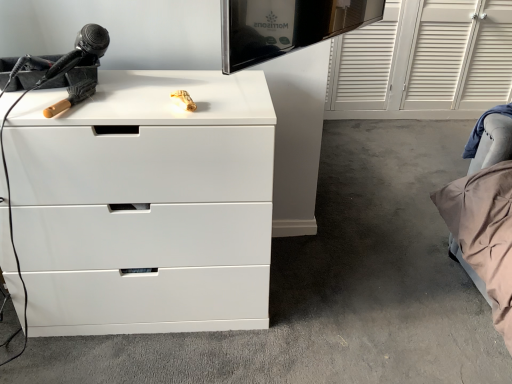
What is the approximate height of white glossy chest of drawers at upper left?

The height of white glossy chest of drawers at upper left is 29.83 inches.

The height and width of the screenshot is (384, 512). What do you see at coordinates (145, 204) in the screenshot? I see `white glossy chest of drawers at upper left` at bounding box center [145, 204].

At what (x,y) coordinates should I click in order to perform the action: click on white glossy chest of drawers at upper left. Please return your answer as a coordinate pair (x, y). This screenshot has width=512, height=384. Looking at the image, I should click on (145, 204).

Image resolution: width=512 pixels, height=384 pixels. Identify the location of white glossy dresser at center. (332, 287).

What do you see at coordinates (332, 287) in the screenshot?
I see `white glossy dresser at center` at bounding box center [332, 287].

This screenshot has width=512, height=384. In order to click on white glossy chest of drawers at upper left in this screenshot , I will do `click(145, 204)`.

In the image, is white glossy dresser at center on the left side or the right side of white glossy chest of drawers at upper left?

In the image, white glossy dresser at center appears on the right side of white glossy chest of drawers at upper left.

Which object is further away from the camera, white glossy dresser at center or white glossy chest of drawers at upper left?

white glossy dresser at center is more distant.

Considering the points (302, 372) and (126, 241), which point is behind, point (302, 372) or point (126, 241)?

The point (302, 372) is farther from the camera.

From the image's perspective, relative to white glossy chest of drawers at upper left, is white glossy dresser at center above or below?

Clearly, from the image's perspective, white glossy dresser at center is above white glossy chest of drawers at upper left.

From a real-world perspective, who is located higher, white glossy dresser at center or white glossy chest of drawers at upper left?

white glossy chest of drawers at upper left.

Looking at this image, in terms of width, does white glossy dresser at center look wider or thinner when compared to white glossy chest of drawers at upper left?

Clearly, white glossy dresser at center has more width compared to white glossy chest of drawers at upper left.

Who is shorter, white glossy dresser at center or white glossy chest of drawers at upper left?

white glossy dresser at center is shorter.

Considering the sizes of white glossy dresser at center and white glossy chest of drawers at upper left in the image, is white glossy dresser at center bigger or smaller than white glossy chest of drawers at upper left?

Clearly, white glossy dresser at center is larger in size than white glossy chest of drawers at upper left.

Is white glossy chest of drawers at upper left surrounded by white glossy dresser at center?

No, white glossy chest of drawers at upper left is not inside white glossy dresser at center.

Based on the photo, is white glossy dresser at center placed right next to white glossy chest of drawers at upper left?

No.

Is white glossy chest of drawers at upper left at the back of white glossy dresser at center?

No, white glossy dresser at center's orientation is not away from white glossy chest of drawers at upper left.

How different are the orientations of white glossy dresser at center and white glossy chest of drawers at upper left in degrees?

The facing directions of white glossy dresser at center and white glossy chest of drawers at upper left are 90.8 degrees apart.

How far apart are white glossy dresser at center and white glossy chest of drawers at upper left?

white glossy dresser at center and white glossy chest of drawers at upper left are 18.66 inches apart.

Image resolution: width=512 pixels, height=384 pixels. I want to click on concrete that is under the white glossy chest of drawers at upper left (from a real-world perspective), so click(x=332, y=287).

Which object is positioned more to the right, white glossy chest of drawers at upper left or white glossy dresser at center?

Positioned to the right is white glossy dresser at center.

Is white glossy chest of drawers at upper left positioned behind white glossy dresser at center?

No, the depth of white glossy chest of drawers at upper left is less than that of white glossy dresser at center.

Which is in front, point (37, 249) or point (155, 368)?

The point (37, 249) is closer.

From the image's perspective, which object appears higher, white glossy chest of drawers at upper left or white glossy dresser at center?

white glossy dresser at center is shown above in the image.

From a real-world perspective, is white glossy chest of drawers at upper left physically located above or below white glossy dresser at center?

white glossy chest of drawers at upper left is situated higher than white glossy dresser at center in the real world.

Is white glossy chest of drawers at upper left wider or thinner than white glossy dresser at center?

white glossy chest of drawers at upper left is thinner than white glossy dresser at center.

Considering the relative sizes of white glossy chest of drawers at upper left and white glossy dresser at center in the image provided, is white glossy chest of drawers at upper left taller than white glossy dresser at center?

Indeed, white glossy chest of drawers at upper left has a greater height compared to white glossy dresser at center.

Is white glossy chest of drawers at upper left smaller than white glossy dresser at center?

Yes.

Is white glossy chest of drawers at upper left not within white glossy dresser at center?

Indeed, white glossy chest of drawers at upper left is completely outside white glossy dresser at center.

Is the surface of white glossy chest of drawers at upper left in direct contact with white glossy dresser at center?

No, white glossy chest of drawers at upper left is not with white glossy dresser at center.

Is white glossy chest of drawers at upper left facing away from white glossy dresser at center?

That's not correct — white glossy chest of drawers at upper left is not looking away from white glossy dresser at center.

How much distance is there between white glossy chest of drawers at upper left and white glossy dresser at center?

The distance of white glossy chest of drawers at upper left from white glossy dresser at center is 18.66 inches.

In order to click on concrete on the right of white glossy chest of drawers at upper left in this screenshot , I will do `click(332, 287)`.

Identify the location of chest of drawers below the white glossy dresser at center (from the image's perspective). (145, 204).

At what (x,y) coordinates should I click in order to perform the action: click on concrete on the right of white glossy chest of drawers at upper left. Please return your answer as a coordinate pair (x, y). Looking at the image, I should click on (x=332, y=287).